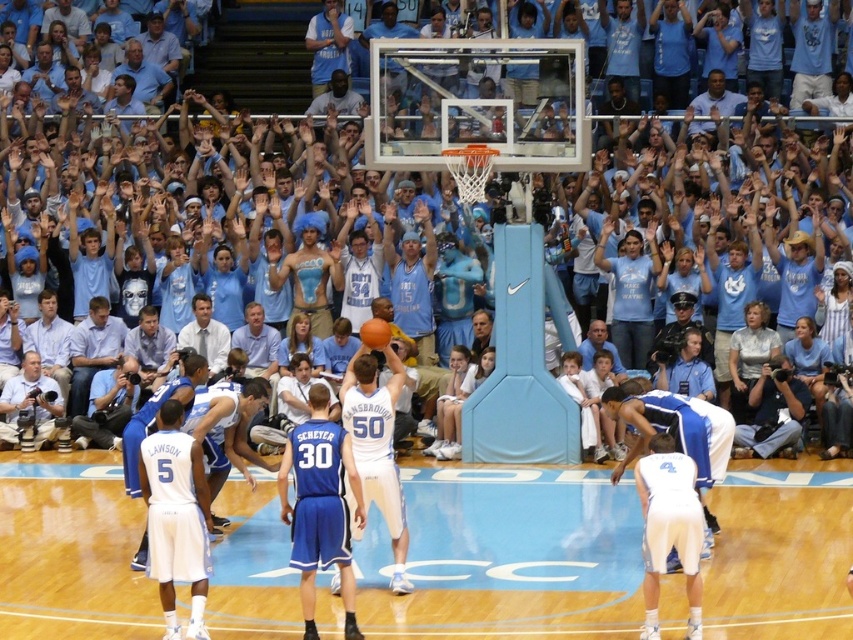
Is wooden floor at center to the left of white matte basketball player at lower right from the viewer's perspective?

Yes, wooden floor at center is to the left of white matte basketball player at lower right.

You are a GUI agent. You are given a task and a screenshot of the screen. Output one action in this format:
    pyautogui.click(x=<x>, y=<y>)
    Task: Click on the wooden floor at center
    
    Given the screenshot: What is the action you would take?
    pyautogui.click(x=508, y=554)

Is wooden floor at center wider than orange matte basketball at center?

Correct, the width of wooden floor at center exceeds that of orange matte basketball at center.

Which is behind, point (529, 515) or point (376, 317)?

The point (376, 317) is more distant.

Where is `wooden floor at center`? The width and height of the screenshot is (853, 640). wooden floor at center is located at coordinates (508, 554).

Which is more to the right, blue fabric jacket at lower left or light blue shirt at center?

light blue shirt at center is more to the right.

This screenshot has width=853, height=640. Describe the element at coordinates (108, 404) in the screenshot. I see `blue fabric jacket at lower left` at that location.

This screenshot has height=640, width=853. Identify the location of blue fabric jacket at lower left. (108, 404).